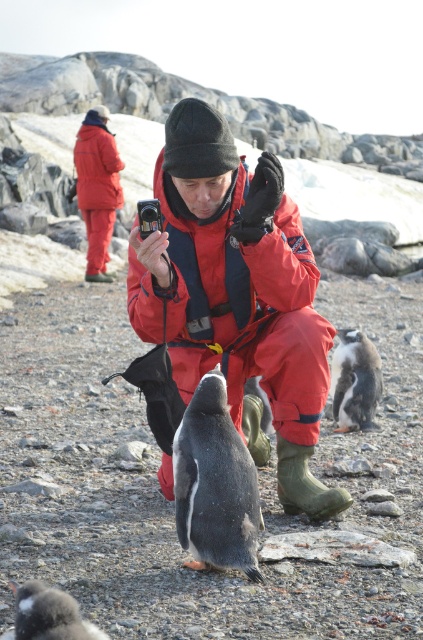
Question: Which object appears farthest from the camera in this image?

Choices:
 (A) gray matte penguin at center
 (B) matte red jacket at center
 (C) black glossy penguin at center
 (D) white fluffy penguin at lower left

Answer: (C)

Question: Can you confirm if gray matte penguin at center is wider than white fluffy penguin at lower left?

Choices:
 (A) no
 (B) yes

Answer: (A)

Question: Does matte red jacket at center lie behind matte red jacket at upper left?

Choices:
 (A) yes
 (B) no

Answer: (B)

Question: Which is nearer to the black glossy penguin at center?

Choices:
 (A) gray matte penguin at center
 (B) matte red jacket at center
 (C) matte red jacket at upper left

Answer: (B)

Question: Estimate the real-world distances between objects in this image. Which object is farther from the black glossy penguin at center?

Choices:
 (A) matte red jacket at center
 (B) white fluffy penguin at lower left
 (C) gray matte penguin at center
 (D) matte red jacket at upper left

Answer: (D)

Question: Can you confirm if gray matte penguin at center is positioned to the left of black glossy penguin at center?

Choices:
 (A) yes
 (B) no

Answer: (A)